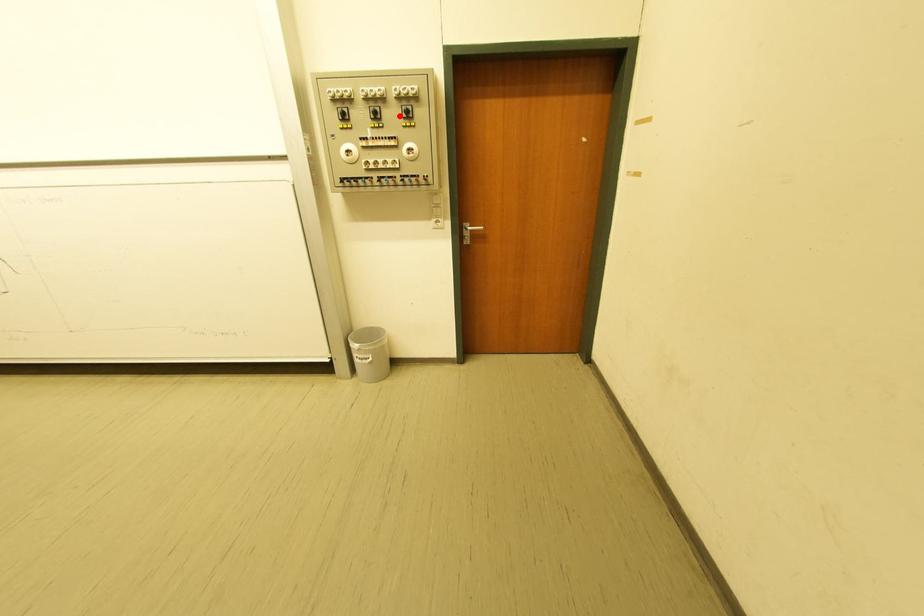
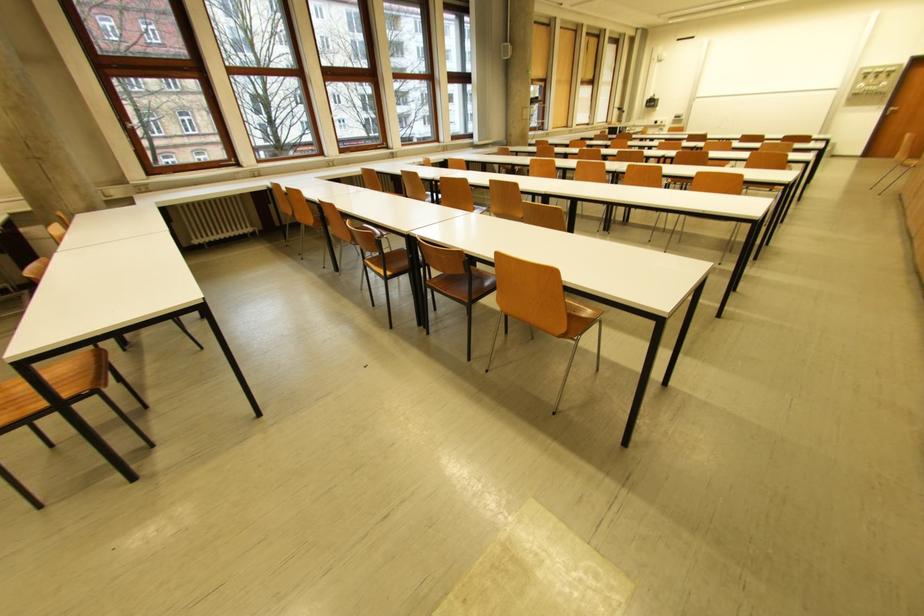
The point at the highlighted location is marked in the first image. Where is the corresponding point in the second image?

(890, 77)